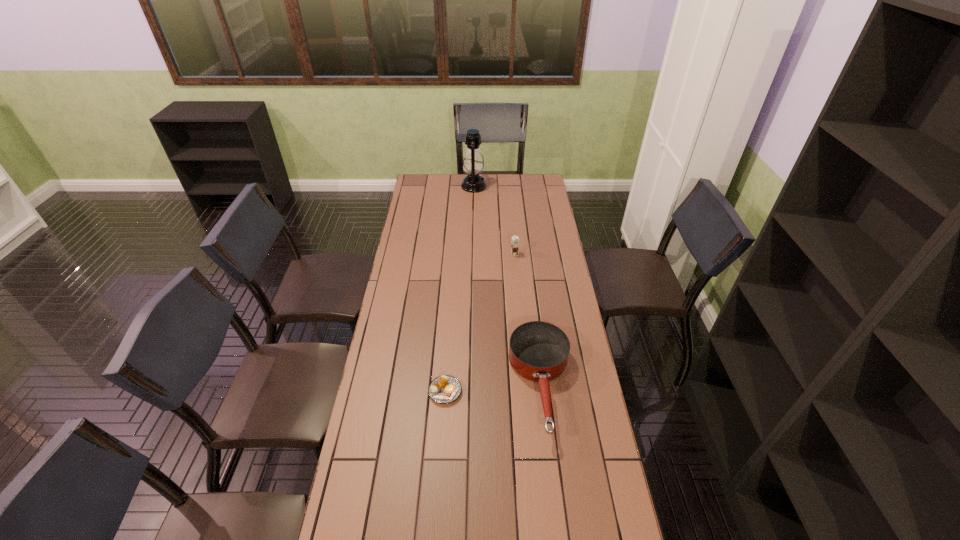
Where is `the tallest object`? the tallest object is located at coordinates (473, 164).

The height and width of the screenshot is (540, 960). Identify the location of the farthest object. (473, 164).

At what (x,y) coordinates should I click in order to perform the action: click on the second farthest object. Please return your answer as a coordinate pair (x, y). Looking at the image, I should click on (515, 240).

Locate an element on the screen. The image size is (960, 540). pan is located at coordinates (538, 351).

Where is `pastry`? pastry is located at coordinates (445, 389).

Where is `vacant region located on the front of the tallest object`? vacant region located on the front of the tallest object is located at coordinates (473, 212).

Find the location of `vacant space located on the right of the chocolate milk`. vacant space located on the right of the chocolate milk is located at coordinates (542, 254).

Find the location of `blank area located on the handle side of the pan`. blank area located on the handle side of the pan is located at coordinates (560, 539).

Locate an element on the screen. The width and height of the screenshot is (960, 540). vacant space located 0.170m on the front of the pastry is located at coordinates (441, 456).

Where is `object that is positioned at the far edge`? The height and width of the screenshot is (540, 960). object that is positioned at the far edge is located at coordinates (473, 164).